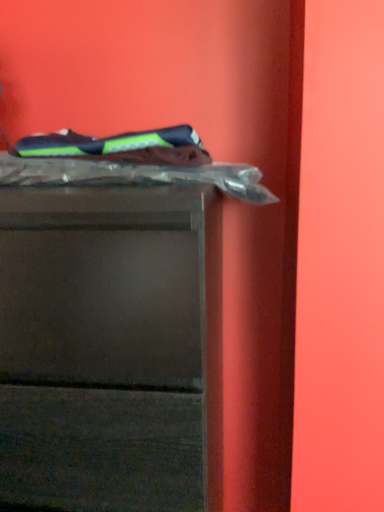
Question: Is dark blue fabric at upper left, the 2th laundry positioned from the bottom, at the right side of clear plastic laundry at upper center, the 1th laundry from the bottom?

Choices:
 (A) no
 (B) yes

Answer: (A)

Question: Is dark blue fabric at upper left, the 2th laundry positioned from the bottom, positioned beyond the bounds of clear plastic laundry at upper center, the 2th laundry from the top?

Choices:
 (A) yes
 (B) no

Answer: (A)

Question: Can you confirm if dark blue fabric at upper left, which is the 1th laundry from top to bottom, is smaller than clear plastic laundry at upper center, the 2th laundry from the top?

Choices:
 (A) yes
 (B) no

Answer: (A)

Question: Considering the relative sizes of dark blue fabric at upper left, the 2th laundry positioned from the bottom, and clear plastic laundry at upper center, the 2th laundry from the top, in the image provided, is dark blue fabric at upper left, the 2th laundry positioned from the bottom, bigger than clear plastic laundry at upper center, the 2th laundry from the top,?

Choices:
 (A) yes
 (B) no

Answer: (B)

Question: Is the depth of dark blue fabric at upper left, which is the 1th laundry from top to bottom, greater than that of clear plastic laundry at upper center, the 1th laundry from the bottom?

Choices:
 (A) no
 (B) yes

Answer: (A)

Question: Is clear plastic laundry at upper center, the 2th laundry from the top, located within dark blue fabric at upper left, the 2th laundry positioned from the bottom?

Choices:
 (A) no
 (B) yes

Answer: (A)

Question: Can you confirm if dark blue fabric at upper left, the 2th laundry positioned from the bottom, is shorter than matte plastic chest of drawers at upper left?

Choices:
 (A) yes
 (B) no

Answer: (A)

Question: Is the depth of dark blue fabric at upper left, the 2th laundry positioned from the bottom, less than that of matte plastic chest of drawers at upper left?

Choices:
 (A) yes
 (B) no

Answer: (B)

Question: Considering the relative positions of dark blue fabric at upper left, the 2th laundry positioned from the bottom, and matte plastic chest of drawers at upper left in the image provided, is dark blue fabric at upper left, the 2th laundry positioned from the bottom, to the right of matte plastic chest of drawers at upper left from the viewer's perspective?

Choices:
 (A) no
 (B) yes

Answer: (B)

Question: From a real-world perspective, is dark blue fabric at upper left, which is the 1th laundry from top to bottom, under matte plastic chest of drawers at upper left?

Choices:
 (A) no
 (B) yes

Answer: (A)

Question: Does dark blue fabric at upper left, the 2th laundry positioned from the bottom, have a greater width compared to matte plastic chest of drawers at upper left?

Choices:
 (A) no
 (B) yes

Answer: (A)

Question: From the image's perspective, does dark blue fabric at upper left, the 2th laundry positioned from the bottom, appear higher than matte plastic chest of drawers at upper left?

Choices:
 (A) yes
 (B) no

Answer: (A)

Question: From a real-world perspective, is matte plastic chest of drawers at upper left over dark blue fabric at upper left, which is the 1th laundry from top to bottom?

Choices:
 (A) yes
 (B) no

Answer: (B)